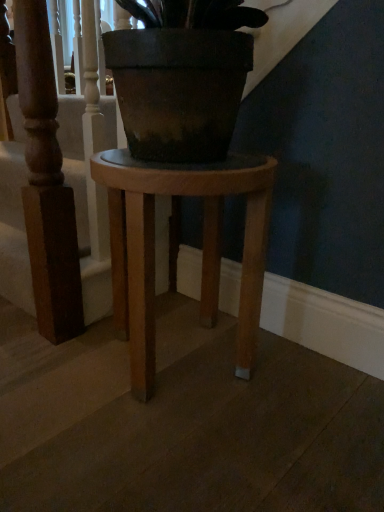
Where is `blank area to the left of wooden stool at center`? This screenshot has height=512, width=384. blank area to the left of wooden stool at center is located at coordinates (49, 369).